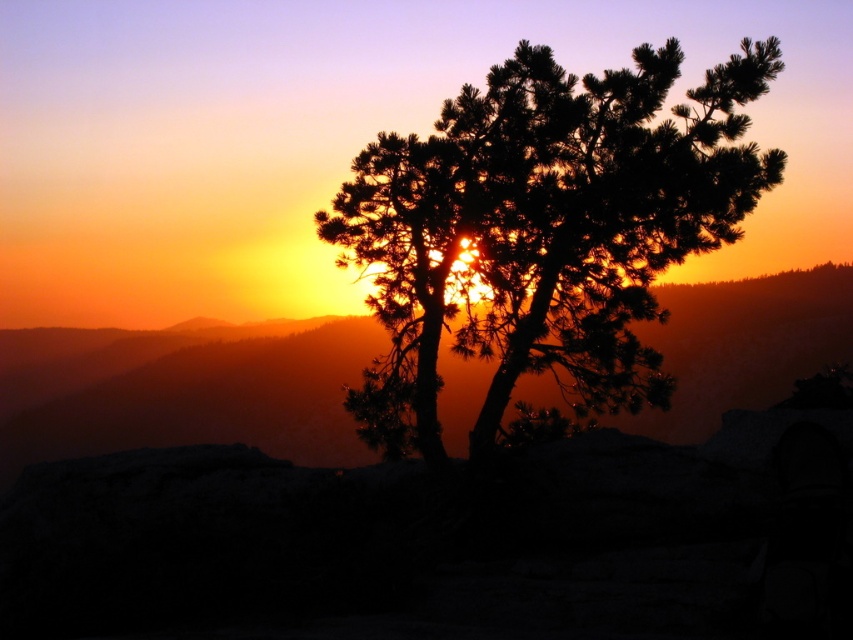
You are an artist trying to paint this sunset scene. You want to ensure the silhouette pine at center and the matte orange mountain at center are proportionally accurate. Which object should you draw first to establish the vertical scale of your painting?

You should draw the silhouette pine at center first since it is taller than the matte orange mountain at center, establishing the vertical scale for the painting.

You are standing in a field and see the silhouette pine at center. If you want to take a photo of it with your camera, which has a maximum focus range of 5 meters, will you be able to capture it clearly?

The silhouette pine at center is 4.93 meters away from the viewer, which is within the camera maximum focus range of 5 meters, so yes, the camera can capture it clearly.